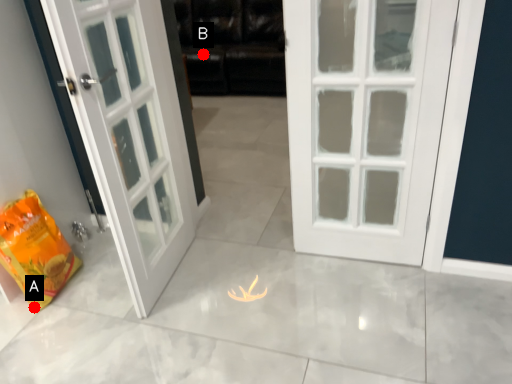
Question: Two points are circled on the image, labeled by A and B beside each circle. Which point is closer to the camera?

Choices:
 (A) A is closer
 (B) B is closer

Answer: (A)